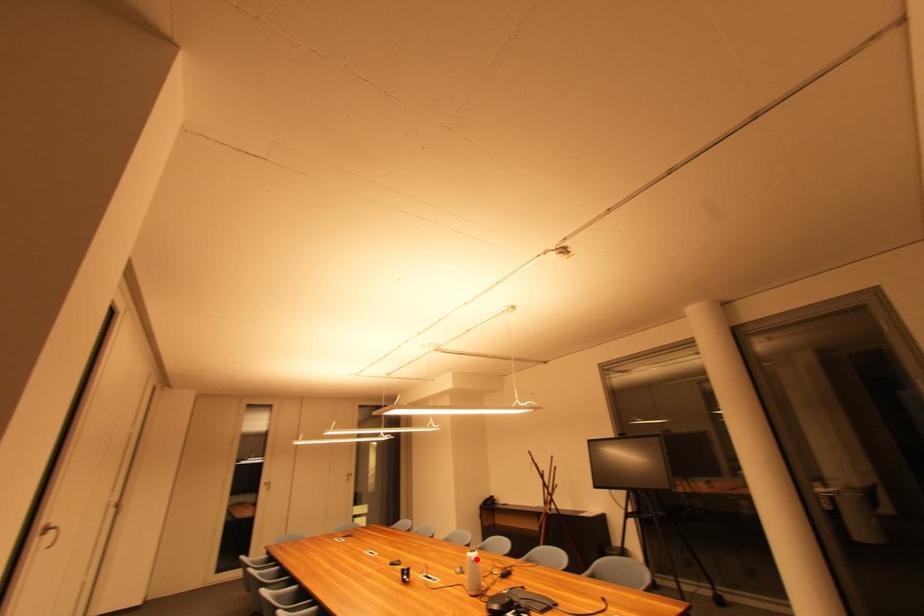
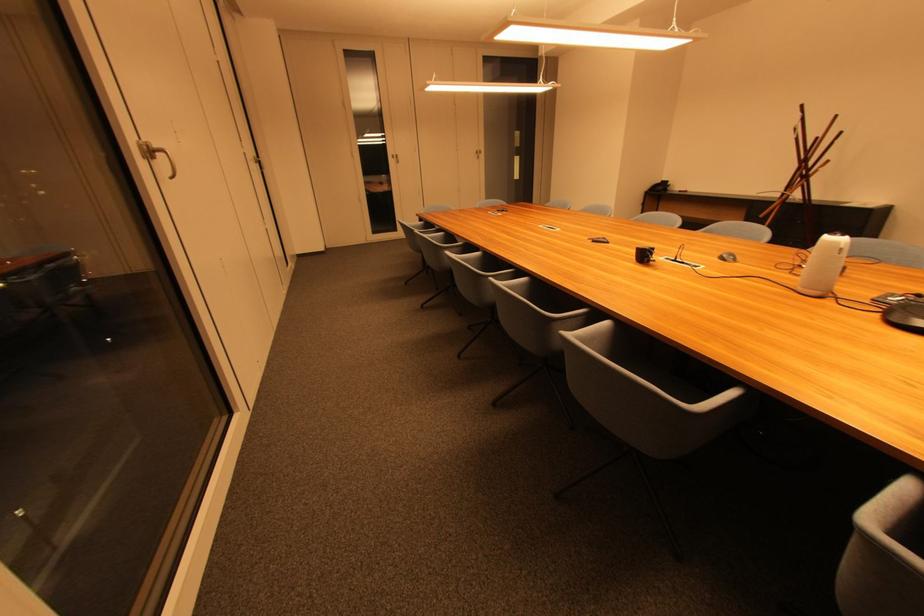
Question: I am providing you with two images of the same scene from different viewpoints. In image1, a red point is highlighted. Considering the same 3D point in image2, which of the following is correct?

Choices:
 (A) It is closer
 (B) It is farther

Answer: (A)